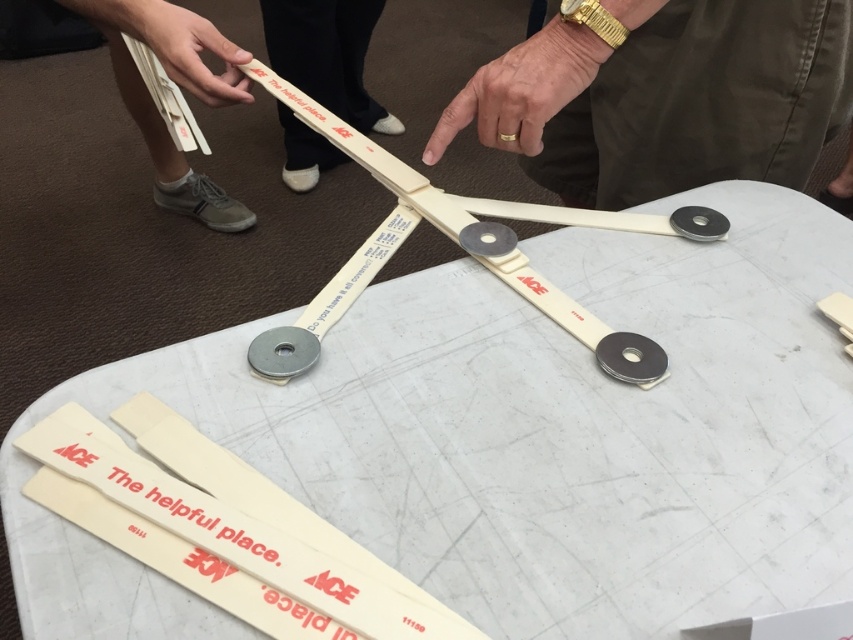
Can you confirm if white plastic table at center is bigger than gold metallic watch at upper center?

Correct, white plastic table at center is larger in size than gold metallic watch at upper center.

Is point (705, 355) behind point (628, 81)?

No, (705, 355) is in front of (628, 81).

Where is `white plastic table at center`? The image size is (853, 640). white plastic table at center is located at coordinates (523, 440).

Who is shorter, gold metallic watch at upper center or white plastic ruler at upper center?

gold metallic watch at upper center is shorter.

Does point (761, 76) come behind point (326, 164)?

No, it is not.

Where is `gold metallic watch at upper center`? gold metallic watch at upper center is located at coordinates (665, 97).

Does white plastic ruler at upper center have a greater height compared to matte white hand at upper left?

Yes, white plastic ruler at upper center is taller than matte white hand at upper left.

What do you see at coordinates (328, 54) in the screenshot?
I see `white plastic ruler at upper center` at bounding box center [328, 54].

Is point (286, 74) closer to viewer compared to point (169, 10)?

No, (286, 74) is behind (169, 10).

Find the location of a particular element. white plastic ruler at upper center is located at coordinates (328, 54).